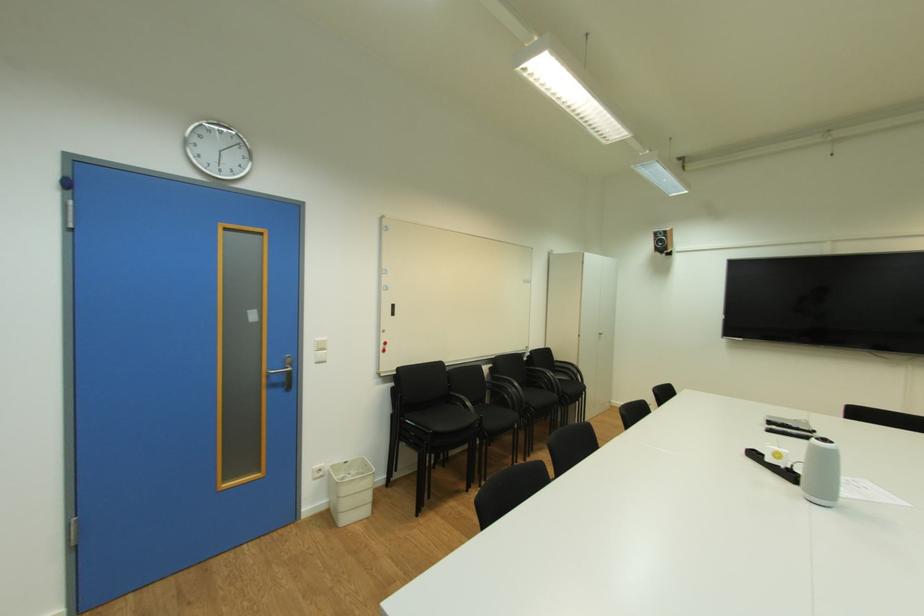
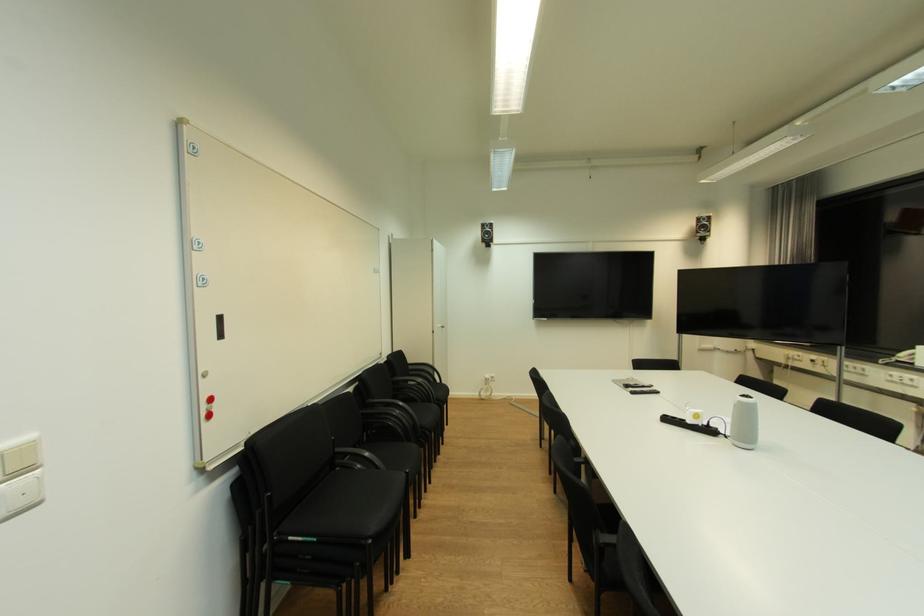
Find the pixel in the second image that matches the point at 455,386 in the first image.

(338, 439)